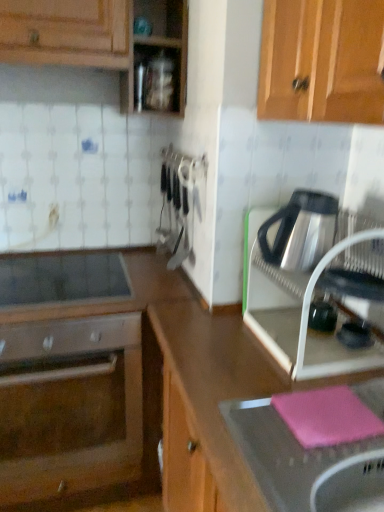
Image resolution: width=384 pixels, height=512 pixels. I want to click on satin silver kettle at right, which ranks as the 2th kitchen appliance in bottom-to-top order, so click(300, 231).

What is the approximate height of satin silver oven at lower left?

23.77 inches.

In order to face satin silver oven at lower left, should I rotate leftwards or rightwards?

You should look left and rotate roughly 17.386 degrees.

What is the approximate width of shiny metallic kettle at right, which ranks as the first kitchen appliance in bottom-to-top order?

shiny metallic kettle at right, which ranks as the first kitchen appliance in bottom-to-top order, is 13.02 inches in width.

Measure the distance between point (x=380, y=404) and camera.

37.09 inches.

Locate an element on the screen. satin silver kettle at right, which ranks as the 2th kitchen appliance in bottom-to-top order is located at coordinates (300, 231).

Is the position of shiny metallic kettle at right, the second kitchen appliance positioned from the top, less distant than that of smooth glass cooktop at center-left?

Yes, it is.

Does shiny metallic kettle at right, the second kitchen appliance positioned from the top, turn towards smooth glass cooktop at center-left?

No, shiny metallic kettle at right, the second kitchen appliance positioned from the top, is not aimed at smooth glass cooktop at center-left.

From their relative heights in the image, would you say shiny metallic kettle at right, the second kitchen appliance positioned from the top, is taller or shorter than smooth glass cooktop at center-left?

Clearly, shiny metallic kettle at right, the second kitchen appliance positioned from the top, is taller compared to smooth glass cooktop at center-left.

From a real-world perspective, is satin silver kettle at right, acting as the 1th kitchen appliance starting from the top, on top of smooth glass cooktop at center-left?

Indeed, from a real-world perspective, satin silver kettle at right, acting as the 1th kitchen appliance starting from the top, stands above smooth glass cooktop at center-left.

Considering the sizes of satin silver kettle at right, which ranks as the 2th kitchen appliance in bottom-to-top order, and smooth glass cooktop at center-left in the image, is satin silver kettle at right, which ranks as the 2th kitchen appliance in bottom-to-top order, bigger or smaller than smooth glass cooktop at center-left?

satin silver kettle at right, which ranks as the 2th kitchen appliance in bottom-to-top order, is bigger than smooth glass cooktop at center-left.

Considering the relative positions of satin silver kettle at right, which ranks as the 2th kitchen appliance in bottom-to-top order, and smooth glass cooktop at center-left in the image provided, is satin silver kettle at right, which ranks as the 2th kitchen appliance in bottom-to-top order, to the left of smooth glass cooktop at center-left from the viewer's perspective?

In fact, satin silver kettle at right, which ranks as the 2th kitchen appliance in bottom-to-top order, is to the right of smooth glass cooktop at center-left.

Is satin silver kettle at right, acting as the 1th kitchen appliance starting from the top, taller or shorter than smooth glass cooktop at center-left?

satin silver kettle at right, acting as the 1th kitchen appliance starting from the top, is taller than smooth glass cooktop at center-left.

Consider the image. Is smooth glass cooktop at center-left to the left or to the right of satin silver oven at lower left in the image?

smooth glass cooktop at center-left is positioned on satin silver oven at lower left's right side.

Is smooth glass cooktop at center-left in front of or behind satin silver oven at lower left in the image?

smooth glass cooktop at center-left is positioned farther from the viewer than satin silver oven at lower left.

Does smooth glass cooktop at center-left turn towards satin silver oven at lower left?

No, smooth glass cooktop at center-left is not turned towards satin silver oven at lower left.

Are smooth glass cooktop at center-left and satin silver oven at lower left located far from each other?

No, smooth glass cooktop at center-left is not far from satin silver oven at lower left.

Which object is more forward, satin silver kettle at right, which ranks as the 2th kitchen appliance in bottom-to-top order, or pink rubber mat at lower right?

pink rubber mat at lower right is more forward.

Which of these two, satin silver kettle at right, which ranks as the 2th kitchen appliance in bottom-to-top order, or pink rubber mat at lower right, stands taller?

With more height is pink rubber mat at lower right.

Is satin silver kettle at right, which ranks as the 2th kitchen appliance in bottom-to-top order, completely or partially outside of pink rubber mat at lower right?

Yes, satin silver kettle at right, which ranks as the 2th kitchen appliance in bottom-to-top order, is not within pink rubber mat at lower right.

Considering the sizes of satin silver kettle at right, acting as the 1th kitchen appliance starting from the top, and pink rubber mat at lower right in the image, is satin silver kettle at right, acting as the 1th kitchen appliance starting from the top, bigger or smaller than pink rubber mat at lower right?

satin silver kettle at right, acting as the 1th kitchen appliance starting from the top, is smaller than pink rubber mat at lower right.

Does pink rubber mat at lower right have a lesser height compared to smooth glass cooktop at center-left?

Incorrect, the height of pink rubber mat at lower right does not fall short of that of smooth glass cooktop at center-left.

In the scene shown: Considering the positions of objects pink rubber mat at lower right and smooth glass cooktop at center-left in the image provided, who is more to the left, pink rubber mat at lower right or smooth glass cooktop at center-left?

smooth glass cooktop at center-left is more to the left.

In the scene shown: Is pink rubber mat at lower right further to the viewer compared to smooth glass cooktop at center-left?

No, it is not.

Does pink rubber mat at lower right touch smooth glass cooktop at center-left?

No, pink rubber mat at lower right is not with smooth glass cooktop at center-left.

Does satin silver oven at lower left have a lesser height compared to satin silver kettle at right, which ranks as the 2th kitchen appliance in bottom-to-top order?

No, satin silver oven at lower left is not shorter than satin silver kettle at right, which ranks as the 2th kitchen appliance in bottom-to-top order.

From the image's perspective, which is below, satin silver oven at lower left or satin silver kettle at right, acting as the 1th kitchen appliance starting from the top?

satin silver oven at lower left, from the image's perspective.

Is satin silver oven at lower left outside of satin silver kettle at right, which ranks as the 2th kitchen appliance in bottom-to-top order?

That's correct, satin silver oven at lower left is outside of satin silver kettle at right, which ranks as the 2th kitchen appliance in bottom-to-top order.

Consider the image. From a real-world perspective, who is located higher, satin silver oven at lower left or satin silver kettle at right, acting as the 1th kitchen appliance starting from the top?

satin silver kettle at right, acting as the 1th kitchen appliance starting from the top.

In the scene shown: Which is more to the right, satin silver oven at lower left or shiny metallic kettle at right, which ranks as the first kitchen appliance in bottom-to-top order?

shiny metallic kettle at right, which ranks as the first kitchen appliance in bottom-to-top order, is more to the right.

Looking at this image, can you tell me how much satin silver oven at lower left and shiny metallic kettle at right, which ranks as the first kitchen appliance in bottom-to-top order, differ in facing direction?

The angular difference between satin silver oven at lower left and shiny metallic kettle at right, which ranks as the first kitchen appliance in bottom-to-top order, is 90 degrees.

Considering the sizes of objects satin silver oven at lower left and shiny metallic kettle at right, which ranks as the first kitchen appliance in bottom-to-top order, in the image provided, who is bigger, satin silver oven at lower left or shiny metallic kettle at right, which ranks as the first kitchen appliance in bottom-to-top order,?

With larger size is satin silver oven at lower left.

Can you confirm if satin silver oven at lower left is shorter than shiny metallic kettle at right, the second kitchen appliance positioned from the top?

No, satin silver oven at lower left is not shorter than shiny metallic kettle at right, the second kitchen appliance positioned from the top.

You are a GUI agent. You are given a task and a screenshot of the screen. Output one action in this format:
    pyautogui.click(x=<x>, y=<y>)
    Task: Click on the home appliance directly beneath the shiny metallic kettle at right, the second kitchen appliance positioned from the top (from a real-world perspective)
    This screenshot has width=384, height=512.
    Given the screenshot: What is the action you would take?
    pyautogui.click(x=62, y=279)

Find the location of a particular element. home appliance behind the satin silver kettle at right, acting as the 1th kitchen appliance starting from the top is located at coordinates (62, 279).

Estimate the real-world distances between objects in this image. Which object is further from satin silver oven at lower left, pink rubber mat at lower right or smooth glass cooktop at center-left?

pink rubber mat at lower right.

When comparing their distances from shiny metallic kettle at right, the second kitchen appliance positioned from the top, does smooth glass cooktop at center-left or satin silver oven at lower left seem further?

Based on the image, satin silver oven at lower left appears to be further to shiny metallic kettle at right, the second kitchen appliance positioned from the top.

Which object lies nearer to the anchor point satin silver kettle at right, which ranks as the 2th kitchen appliance in bottom-to-top order, smooth glass cooktop at center-left or pink rubber mat at lower right?

pink rubber mat at lower right lies closer to satin silver kettle at right, which ranks as the 2th kitchen appliance in bottom-to-top order, than the other object.

Estimate the real-world distances between objects in this image. Which object is further from shiny metallic kettle at right, which ranks as the first kitchen appliance in bottom-to-top order, pink rubber mat at lower right or smooth glass cooktop at center-left?

smooth glass cooktop at center-left is positioned further to the anchor shiny metallic kettle at right, which ranks as the first kitchen appliance in bottom-to-top order.

When comparing their distances from satin silver kettle at right, which ranks as the 2th kitchen appliance in bottom-to-top order, does shiny metallic kettle at right, which ranks as the first kitchen appliance in bottom-to-top order, or pink rubber mat at lower right seem closer?

Based on the image, shiny metallic kettle at right, which ranks as the first kitchen appliance in bottom-to-top order, appears to be nearer to satin silver kettle at right, which ranks as the 2th kitchen appliance in bottom-to-top order.

Which object lies nearer to the anchor point satin silver kettle at right, which ranks as the 2th kitchen appliance in bottom-to-top order, pink rubber mat at lower right or shiny metallic kettle at right, which ranks as the first kitchen appliance in bottom-to-top order?

Among the two, shiny metallic kettle at right, which ranks as the first kitchen appliance in bottom-to-top order, is located nearer to satin silver kettle at right, which ranks as the 2th kitchen appliance in bottom-to-top order.

Considering their positions, is satin silver kettle at right, acting as the 1th kitchen appliance starting from the top, positioned further to satin silver oven at lower left than smooth glass cooktop at center-left?

satin silver kettle at right, acting as the 1th kitchen appliance starting from the top, is positioned further to the anchor satin silver oven at lower left.

Looking at the image, which one is located closer to smooth glass cooktop at center-left, satin silver oven at lower left or satin silver kettle at right, which ranks as the 2th kitchen appliance in bottom-to-top order?

satin silver kettle at right, which ranks as the 2th kitchen appliance in bottom-to-top order, lies closer to smooth glass cooktop at center-left than the other object.

Where is `kitchen appliance situated between satin silver oven at lower left and pink rubber mat at lower right from left to right`? kitchen appliance situated between satin silver oven at lower left and pink rubber mat at lower right from left to right is located at coordinates (300, 231).

Identify the location of home appliance situated between satin silver oven at lower left and satin silver kettle at right, which ranks as the 2th kitchen appliance in bottom-to-top order, from left to right. This screenshot has height=512, width=384. (62, 279).

In order to click on sink between smooth glass cooktop at center-left and shiny metallic kettle at right, which ranks as the first kitchen appliance in bottom-to-top order in this screenshot , I will do `click(305, 463)`.

At what (x,y) coordinates should I click in order to perform the action: click on kitchen appliance between satin silver kettle at right, acting as the 1th kitchen appliance starting from the top, and pink rubber mat at lower right vertically. Please return your answer as a coordinate pair (x, y). Looking at the image, I should click on pos(310,304).